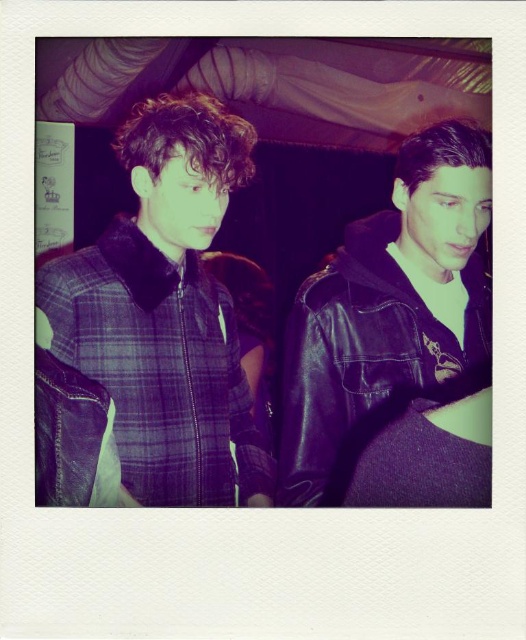
You are a fashion designer analyzing the two jackets in the image. Which jacket is taller when comparing the plaid fabric jacket at left and the black leather jacket at right?

The plaid fabric jacket at left has a greater height compared to the black leather jacket at right.

You are taking a photo with your camera and want to ensure that the subject at point (177,484) is in focus. Based on the given information, what is the recommended distance you should maintain between the camera and the subject to achieve sharp focus?

The recommended distance to maintain between the camera and the subject at point (177,484) is 37.08 inches to ensure sharp focus.

You are trying to locate the plaid fabric jacket at left in a dimly lit room with a purple hue. Based on the coordinates provided in the description, can you determine its position relative to the center of the image?

The plaid fabric jacket at left is located at coordinates point (166, 310), which places it slightly to the left and below the center of the image.